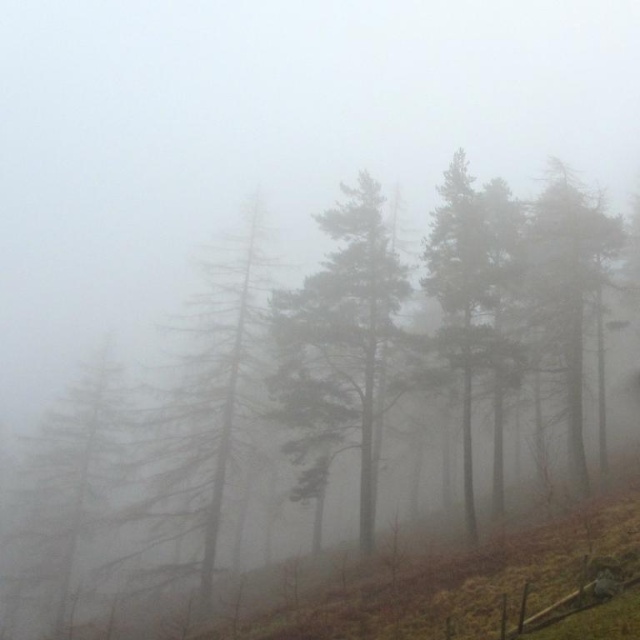
Question: Is green matte tree at center closer to the viewer compared to green textured pine tree at left?

Choices:
 (A) yes
 (B) no

Answer: (A)

Question: Does green textured pine tree at left have a larger size compared to green matte tree at right?

Choices:
 (A) no
 (B) yes

Answer: (A)

Question: Which point appears farthest from the camera in this image?

Choices:
 (A) (308, 371)
 (B) (464, 332)

Answer: (A)

Question: Among these objects, which one is nearest to the camera?

Choices:
 (A) green matte tree at right
 (B) green matte tree at center

Answer: (B)

Question: Which point is farther from the camera taking this photo?

Choices:
 (A) (33, 540)
 (B) (577, 378)
 (C) (368, 317)
 (D) (257, 244)

Answer: (D)

Question: From the image, what is the correct spatial relationship of green matte tree at center in relation to green textured pine tree at center?

Choices:
 (A) below
 (B) above

Answer: (B)